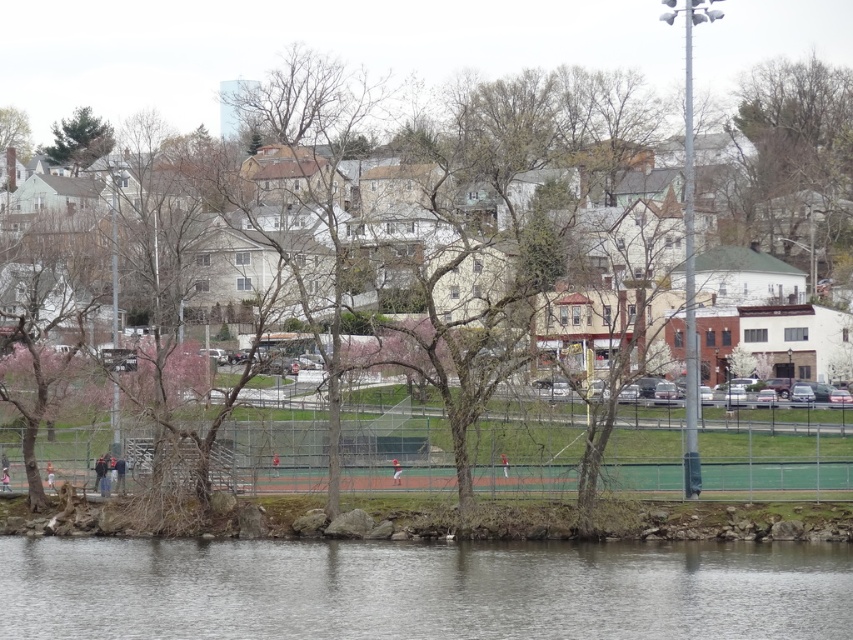
You are a photographer wanting to capture both the green leafy tree at upper left and the light brown wooden bench at lower left in your shot. Which object will appear larger in the photo?

The green leafy tree at upper left will appear larger in the photo because it is bigger than the light brown wooden bench at lower left.

You are standing on the sports field and want to walk towards the green leafy tree at upper left and the matte baseball uniform at center. Which object will you encounter first?

You will encounter the green leafy tree at upper left first because it is closer to you than the matte baseball uniform at center.